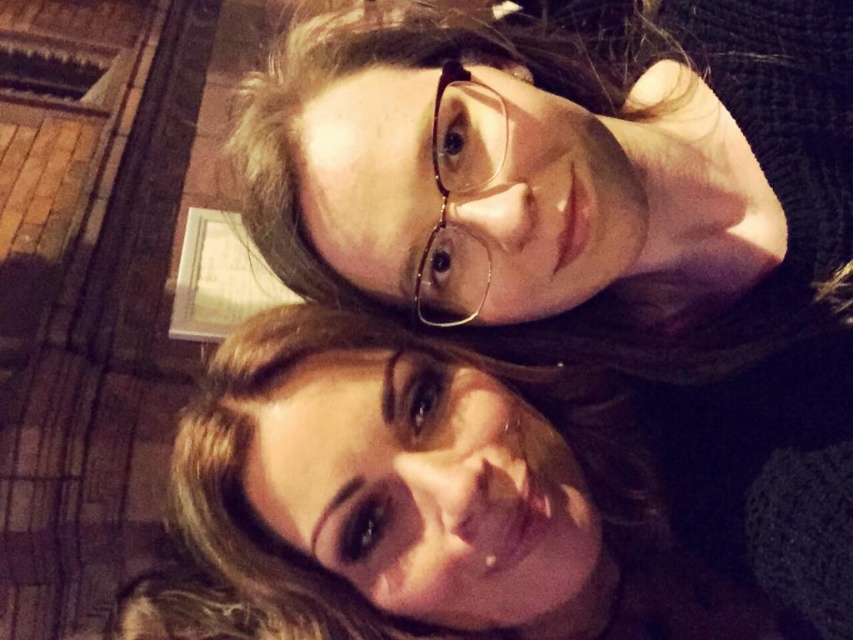
You are trying to take a photo of the smooth brown hair at center and the clear plastic glasses at center. Which object should you focus on first if you want to capture both in the same frame without moving the camera?

The smooth brown hair at center is bigger than clear plastic glasses at center, so you should focus on the smooth brown hair at center first to ensure it is in focus before adjusting for the smaller clear plastic glasses at center.